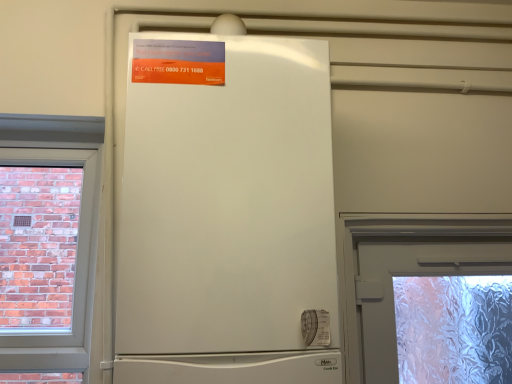
Question: From a real-world perspective, is orange glossy poster at upper center above or below white matte refrigerator at center?

Choices:
 (A) below
 (B) above

Answer: (B)

Question: From the image's perspective, is orange glossy poster at upper center positioned above or below white matte refrigerator at center?

Choices:
 (A) below
 (B) above

Answer: (B)

Question: Considering the positions of orange glossy poster at upper center and white matte refrigerator at center in the image, is orange glossy poster at upper center taller or shorter than white matte refrigerator at center?

Choices:
 (A) tall
 (B) short

Answer: (B)

Question: Considering the positions of white matte refrigerator at center and orange glossy poster at upper center in the image, is white matte refrigerator at center taller or shorter than orange glossy poster at upper center?

Choices:
 (A) tall
 (B) short

Answer: (A)

Question: Considering the positions of white matte refrigerator at center and orange glossy poster at upper center in the image, is white matte refrigerator at center bigger or smaller than orange glossy poster at upper center?

Choices:
 (A) big
 (B) small

Answer: (A)

Question: From the image's perspective, relative to orange glossy poster at upper center, is white matte refrigerator at center above or below?

Choices:
 (A) above
 (B) below

Answer: (B)

Question: Is white matte refrigerator at center in front of or behind orange glossy poster at upper center in the image?

Choices:
 (A) behind
 (B) front

Answer: (B)